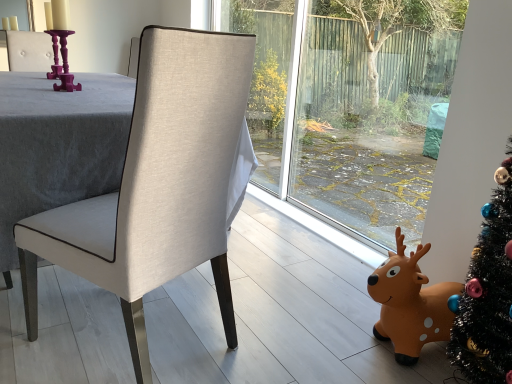
At what (x,y) coordinates should I click in order to perform the action: click on free location to the left of orange rubber reindeer at lower right. Please return your answer as a coordinate pair (x, y). Looking at the image, I should click on (323, 331).